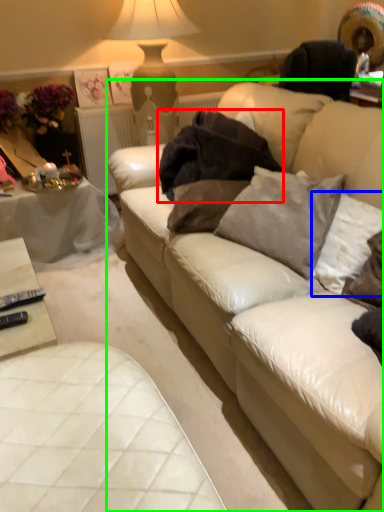
Question: Estimate the real-world distances between objects in this image. Which object is closer to blanket (highlighted by a red box), pillow (highlighted by a blue box) or studio couch (highlighted by a green box)?

Choices:
 (A) pillow
 (B) studio couch

Answer: (B)